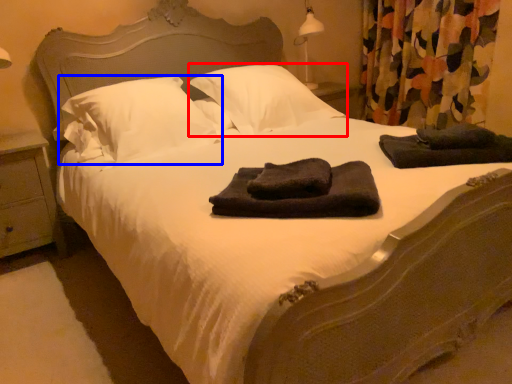
Question: Which object appears closest to the camera in this image, pillow (highlighted by a red box) or pillow (highlighted by a blue box)?

Choices:
 (A) pillow
 (B) pillow

Answer: (B)